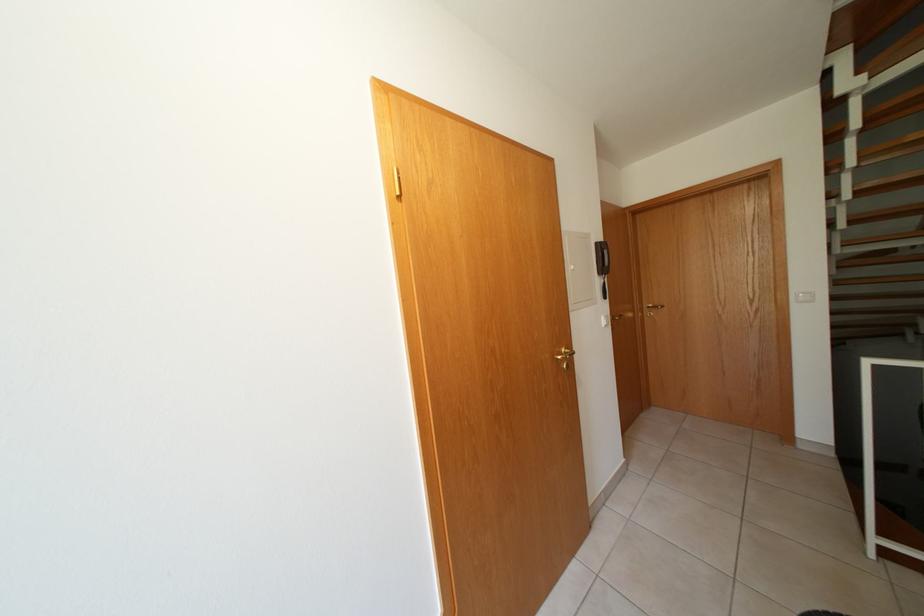
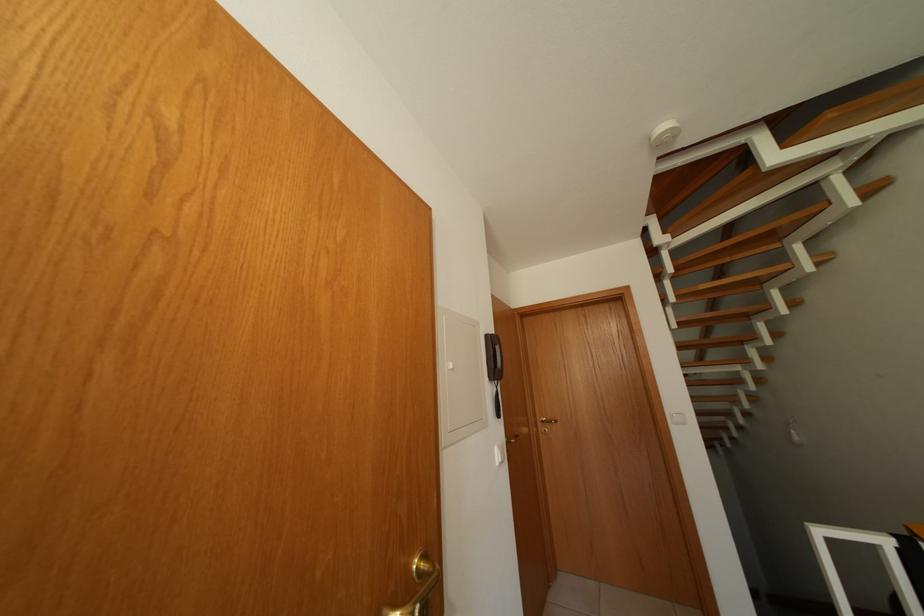
Locate, in the second image, the point that corresponds to (609,253) in the first image.

(500, 346)